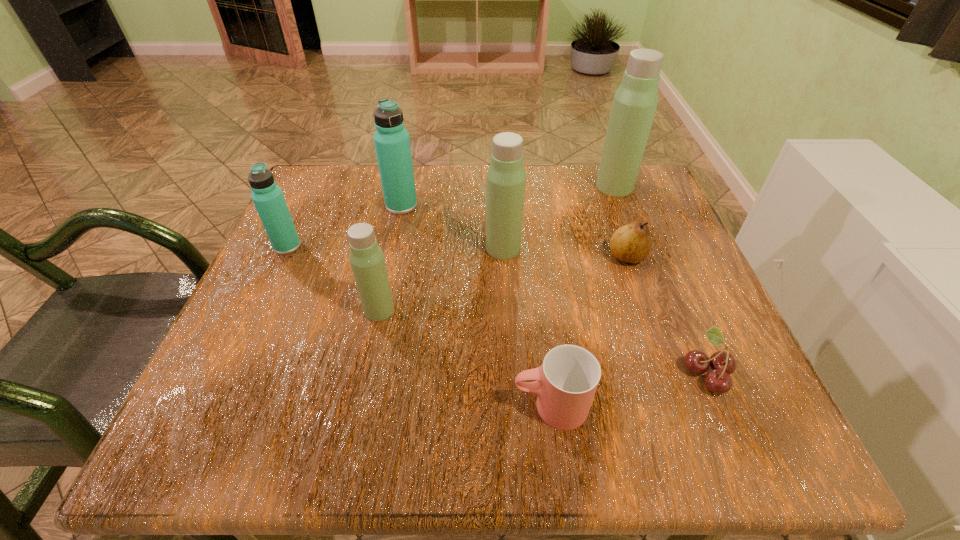
Find the location of a particular element. This screenshot has height=540, width=960. vacant area situated 0.270m on the side of the cup with the handle is located at coordinates (328, 406).

The height and width of the screenshot is (540, 960). I want to click on vacant space located on the side of the cup with the handle, so (x=362, y=406).

This screenshot has width=960, height=540. In order to click on vacant point located on the side of the cup with the handle in this screenshot , I will do `click(322, 406)`.

This screenshot has height=540, width=960. Find the location of `vacant space located on the leaves of the cherry`. vacant space located on the leaves of the cherry is located at coordinates (612, 372).

Locate an element on the screen. vacant space located 0.320m on the leaves of the cherry is located at coordinates (477, 372).

The width and height of the screenshot is (960, 540). Identify the location of vacant space located on the leaves of the cherry. (547, 372).

You are a GUI agent. You are given a task and a screenshot of the screen. Output one action in this format:
    pyautogui.click(x=<x>, y=<y>)
    Task: Click on the cup located at the near edge
    This screenshot has width=960, height=540.
    Given the screenshot: What is the action you would take?
    pyautogui.click(x=565, y=384)

This screenshot has width=960, height=540. I want to click on cherry present at the near edge, so click(x=718, y=380).

Where is `object present at the left edge`? Image resolution: width=960 pixels, height=540 pixels. object present at the left edge is located at coordinates (268, 198).

You are a GUI agent. You are given a task and a screenshot of the screen. Output one action in this format:
    pyautogui.click(x=<x>, y=<y>)
    Task: Click on the thermos bottle located at the right edge
    
    Given the screenshot: What is the action you would take?
    click(634, 105)